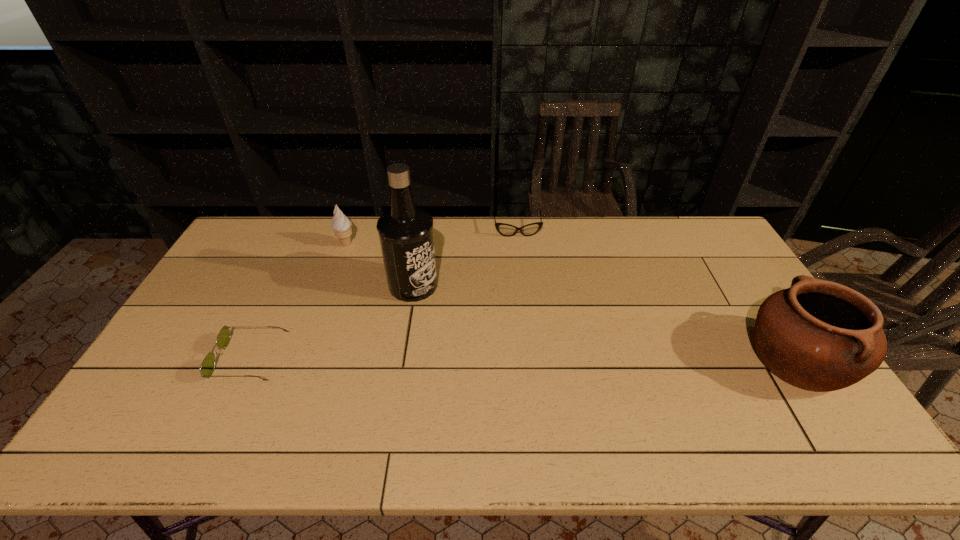
The height and width of the screenshot is (540, 960). In the image, there is a desktop. Identify the location of blank space at the left edge. (267, 260).

In the image, there is a desktop. Identify the location of free region at the right edge. (755, 299).

Identify the location of free space at the far left corner of the desktop. Image resolution: width=960 pixels, height=540 pixels. (254, 236).

In the image, there is a desktop. In order to click on free space at the near left corner in this screenshot , I will do `click(169, 392)`.

This screenshot has height=540, width=960. I want to click on vacant region at the near right corner, so click(x=824, y=401).

Where is `free space between the second tallest object and the third nearest object`? The width and height of the screenshot is (960, 540). free space between the second tallest object and the third nearest object is located at coordinates (605, 322).

Locate an element on the screen. This screenshot has height=540, width=960. free space between the leftmost object and the second farthest object is located at coordinates (298, 301).

Image resolution: width=960 pixels, height=540 pixels. Find the location of `free space between the second object from left to right and the liquor`. free space between the second object from left to right and the liquor is located at coordinates (379, 265).

The width and height of the screenshot is (960, 540). What are the coordinates of `free space between the second object from left to right and the rightmost object` in the screenshot? It's located at (571, 302).

You are a GUI agent. You are given a task and a screenshot of the screen. Output one action in this format:
    pyautogui.click(x=<x>, y=<y>)
    Task: Click on the free space between the sunglasses and the pottery
    The image size is (960, 540).
    Given the screenshot: What is the action you would take?
    pyautogui.click(x=523, y=359)